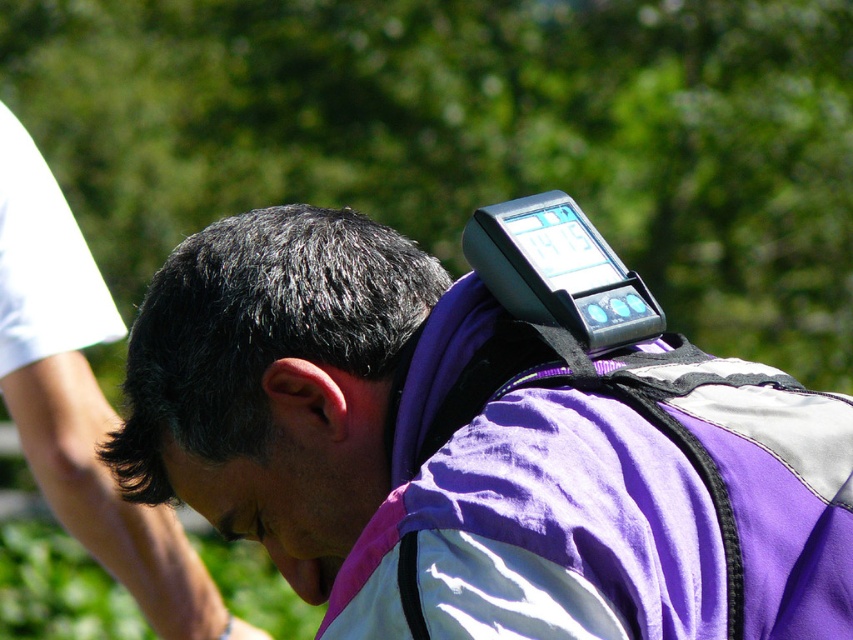
Can you confirm if black matte hair at center is smaller than matte black forehead at center?

Actually, black matte hair at center might be larger than matte black forehead at center.

Is black matte hair at center to the right of matte black forehead at center from the viewer's perspective?

Correct, you'll find black matte hair at center to the right of matte black forehead at center.

Who is more distant from viewer, [444,269] or [175,476]?

Point [444,269]

Where is `black matte hair at center`? This screenshot has width=853, height=640. black matte hair at center is located at coordinates (273, 380).

Looking at this image, which is more to the right, purple fabric backpack at upper center or black matte hair at center?

From the viewer's perspective, purple fabric backpack at upper center appears more on the right side.

What do you see at coordinates (482, 449) in the screenshot? I see `purple fabric backpack at upper center` at bounding box center [482, 449].

Is point (541, 580) positioned behind point (357, 516)?

No, (541, 580) is closer to viewer.

This screenshot has width=853, height=640. Identify the location of purple fabric backpack at upper center. (482, 449).

Who is lower down, purple fabric backpack at upper center or matte black forehead at center?

matte black forehead at center is below.

Is purple fabric backpack at upper center positioned before matte black forehead at center?

Yes, it is in front of matte black forehead at center.

The height and width of the screenshot is (640, 853). I want to click on purple fabric backpack at upper center, so click(x=482, y=449).

At what (x,y) coordinates should I click in order to perform the action: click on purple fabric backpack at upper center. Please return your answer as a coordinate pair (x, y). The image size is (853, 640). Looking at the image, I should click on (482, 449).